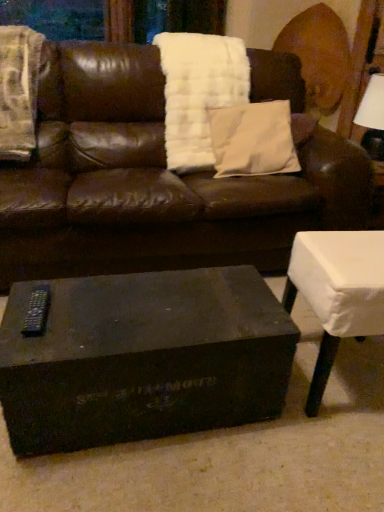
Locate an element on the screen. The height and width of the screenshot is (512, 384). vacant space situated on the left part of black plastic remote at lower left is located at coordinates (11, 310).